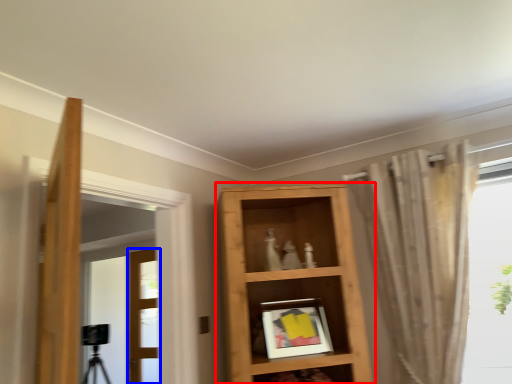
Question: Which point is further to the camera, shelf (highlighted by a red box) or door (highlighted by a blue box)?

Choices:
 (A) shelf
 (B) door

Answer: (B)